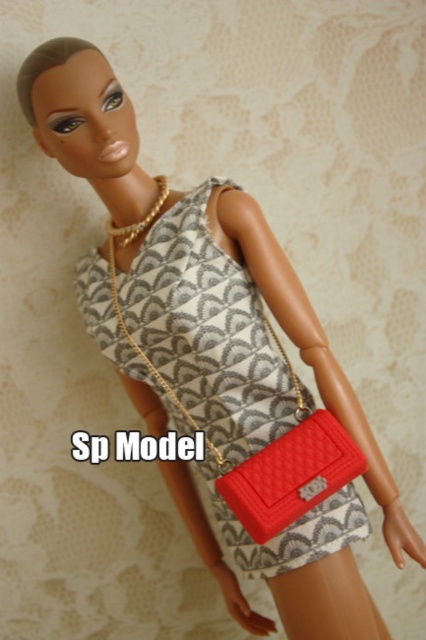
Is point (172, 317) positioned behind point (304, 444)?

Yes, point (172, 317) is farther from viewer.

Is quilted fabric dress at center positioned at the back of matte red clutch at lower right?

Yes, quilted fabric dress at center is further from the viewer.

Who is more distant from viewer, (184, 396) or (236, 516)?

Point (184, 396)

The image size is (426, 640). Identify the location of quilted fabric dress at center. (207, 330).